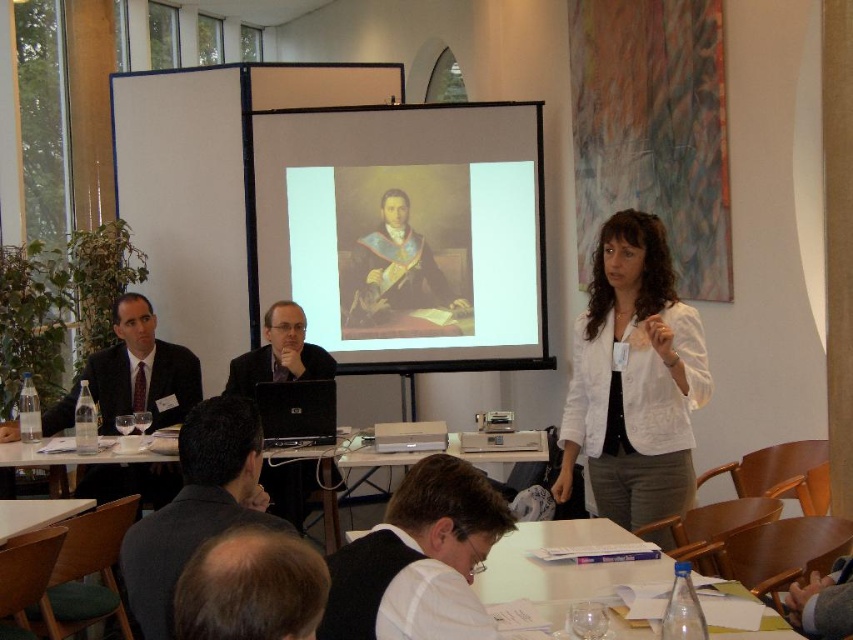
You are an attendee at the presentation. You notice the light brown hair at lower center and the matte black suit at center. Which object is positioned lower in the image?

The light brown hair at lower center is positioned lower than the matte black suit at center.

In the presentation setting, where is the matte canvas projection screen at center located relative to the light brown hair at lower center?

The matte canvas projection screen at center is to the right of the light brown hair at lower center.

Looking at this image, where is the white textured blazer at center located in the image?

The white textured blazer at center is located at point [633,380].